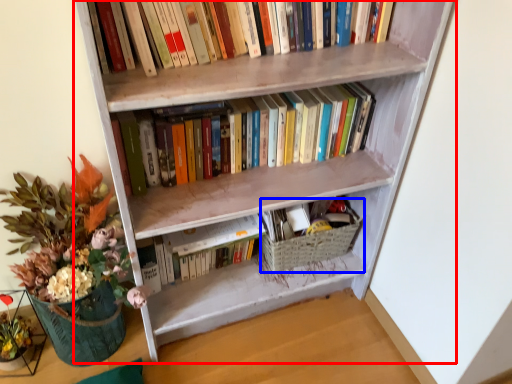
Question: Which object is closer to the camera taking this photo, bookcase (highlighted by a red box) or basket (highlighted by a blue box)?

Choices:
 (A) bookcase
 (B) basket

Answer: (A)